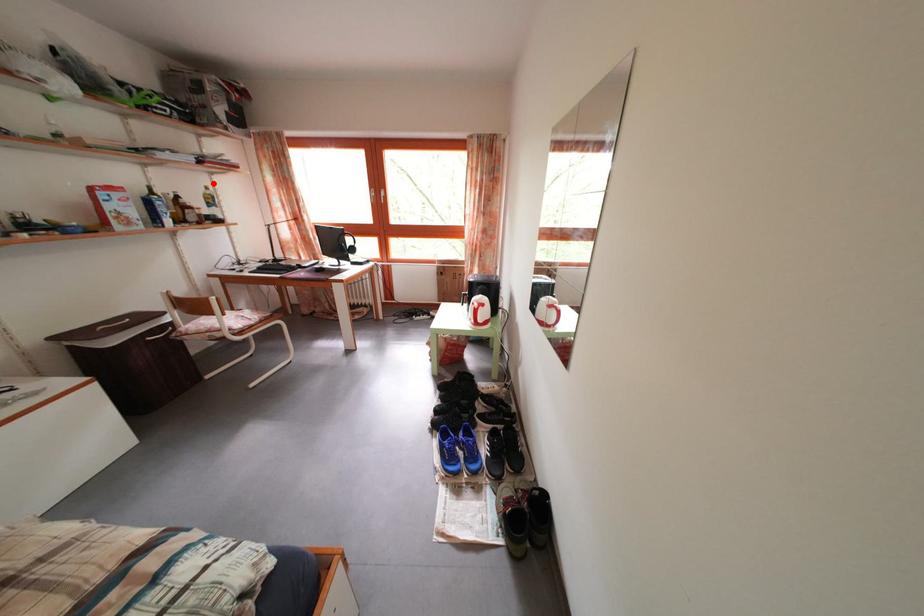
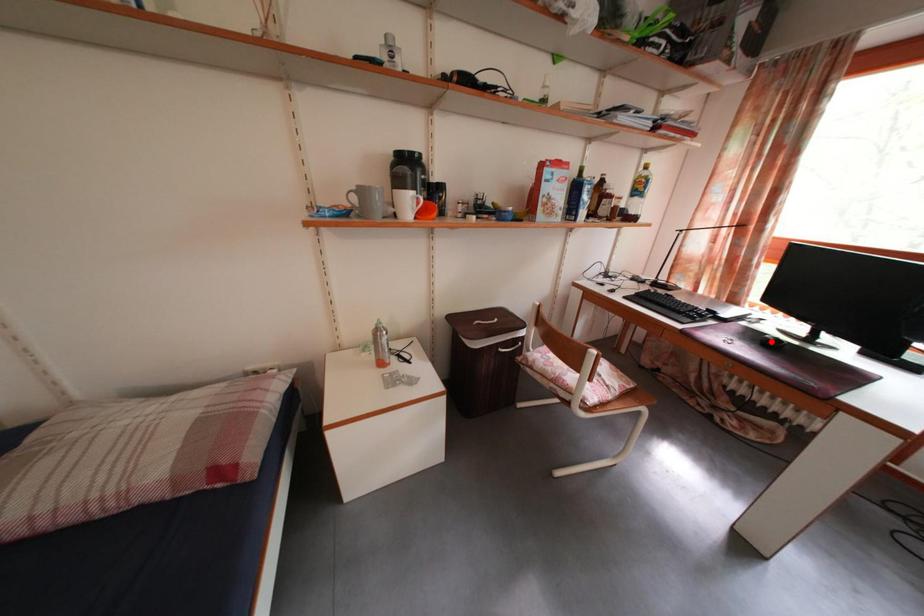
Consider the image. I am providing you with two images of the same scene from different viewpoints. A red point is marked on the first image and another point is marked on the second image. Is the marked point in image1 the same physical position as the marked point in image2?

No